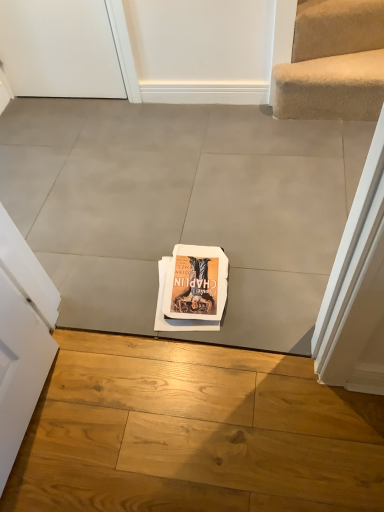
Find the location of `vacant point above gray tile floor at center, the second concrete in the top-to-bottom sequence (from a real-world perspective)`. vacant point above gray tile floor at center, the second concrete in the top-to-bottom sequence (from a real-world perspective) is located at coordinates (171, 437).